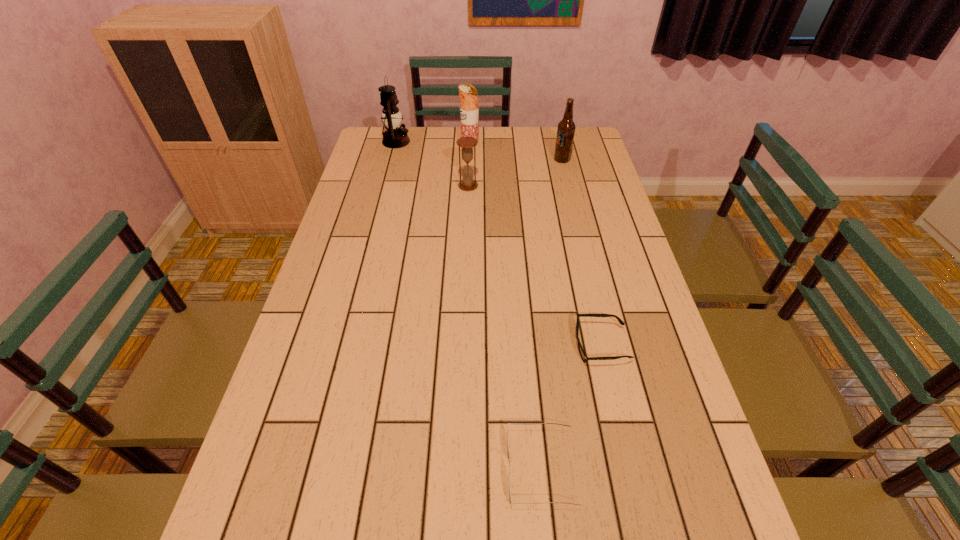
Where is `vacant space at the left edge`? Image resolution: width=960 pixels, height=540 pixels. vacant space at the left edge is located at coordinates (339, 442).

You are a GUI agent. You are given a task and a screenshot of the screen. Output one action in this format:
    pyautogui.click(x=<x>, y=<y>)
    Task: Click on the blank space at the right edge of the desktop
    The height and width of the screenshot is (540, 960).
    Given the screenshot: What is the action you would take?
    pyautogui.click(x=629, y=303)

The height and width of the screenshot is (540, 960). Find the location of `free space at the far right corner of the desktop`. free space at the far right corner of the desktop is located at coordinates (583, 131).

Locate an element on the screen. The image size is (960, 540). free space between the right sunglasses and the third farthest object is located at coordinates (582, 253).

The image size is (960, 540). What are the coordinates of `empty space that is in between the leftmost object and the third farthest object` in the screenshot? It's located at (479, 151).

You are a GUI agent. You are given a task and a screenshot of the screen. Output one action in this format:
    pyautogui.click(x=<x>, y=<y>)
    Task: Click on the free space between the hourglass and the fifth farthest object
    
    Given the screenshot: What is the action you would take?
    pyautogui.click(x=535, y=266)

The height and width of the screenshot is (540, 960). I want to click on vacant space in between the farther sunglasses and the third nearest object, so click(x=535, y=266).

Locate an element on the screen. vacant region between the third farthest object and the second nearest object is located at coordinates (582, 253).

Locate an element on the screen. vacant point located between the left sunglasses and the burrito is located at coordinates (506, 307).

Locate an element on the screen. This screenshot has width=960, height=540. vacant point located between the lantern and the nearer sunglasses is located at coordinates (468, 305).